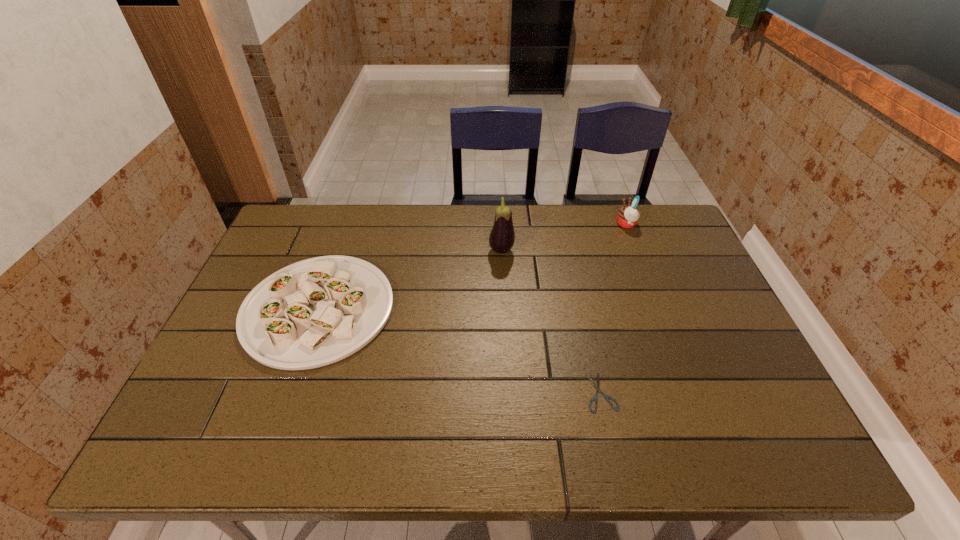
This screenshot has height=540, width=960. In order to click on the second object from left to right in this screenshot , I will do `click(502, 237)`.

What are the coordinates of `the tallest object` in the screenshot? It's located at (502, 237).

Where is `the second tallest object`? The image size is (960, 540). the second tallest object is located at coordinates (627, 217).

Find the location of a particular element. Image resolution: width=960 pixels, height=540 pixels. the rightmost object is located at coordinates (627, 217).

The image size is (960, 540). Find the location of `platter`. platter is located at coordinates (315, 312).

Locate an element on the screen. This screenshot has width=960, height=540. the second shortest object is located at coordinates (315, 312).

Image resolution: width=960 pixels, height=540 pixels. Identify the location of the third object from left to right. (607, 397).

The width and height of the screenshot is (960, 540). In order to click on the nearest object in this screenshot , I will do `click(607, 397)`.

Where is `vacant space located 0.240m on the left of the tallest object`? The height and width of the screenshot is (540, 960). vacant space located 0.240m on the left of the tallest object is located at coordinates (413, 251).

This screenshot has width=960, height=540. In order to click on free space located on the front-facing side of the third shortest object in this screenshot , I will do `click(557, 224)`.